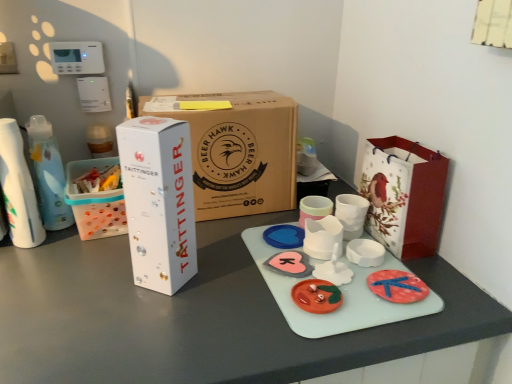
The image size is (512, 384). I want to click on free space in front of white cardboard box at left, so click(x=72, y=256).